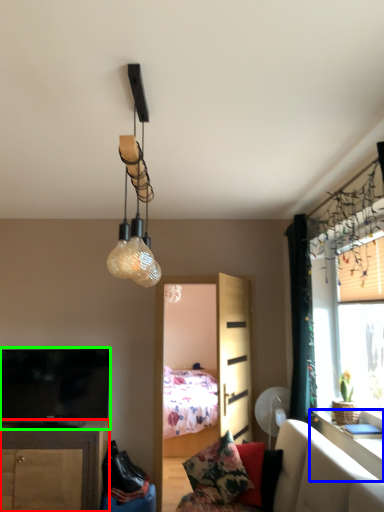
Question: Which object is the closest to the cabinetry (highlighted by a red box)? Choose among these: table (highlighted by a blue box) or television (highlighted by a green box).

Choices:
 (A) table
 (B) television

Answer: (B)